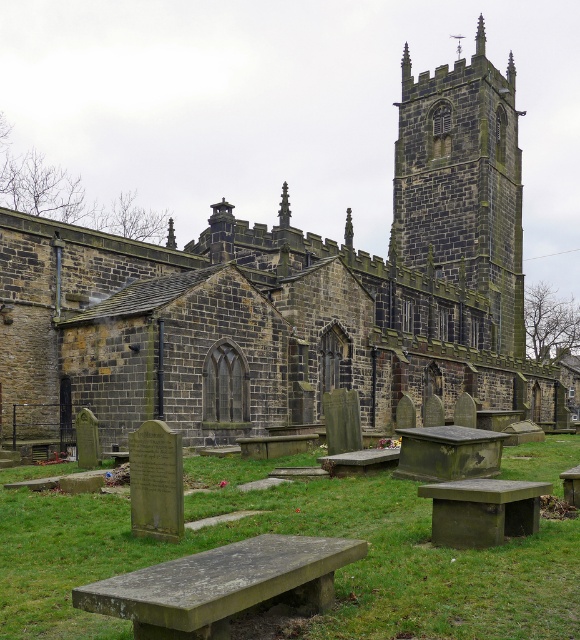
Question: Is gray stone bench at lower center to the left of concrete bench at lower center from the viewer's perspective?

Choices:
 (A) yes
 (B) no

Answer: (A)

Question: Is dark gray stone tower at center thinner than concrete bench at lower center?

Choices:
 (A) yes
 (B) no

Answer: (B)

Question: Which object is closer to the camera taking this photo?

Choices:
 (A) green moss-covered bench at center
 (B) gray stone bench at lower center
 (C) rustic wooden bench at center
 (D) dark gray stone tower at center

Answer: (B)

Question: Can you confirm if gray stone bench at lower center is positioned to the left of wooden bench at lower right?

Choices:
 (A) no
 (B) yes

Answer: (B)

Question: Which of the following is the farthest from the observer?

Choices:
 (A) green mossy stone bench at center
 (B) concrete bench at lower center
 (C) gray stone bench at lower center

Answer: (A)

Question: Among these points, which one is farthest from the camera?

Choices:
 (A) (385, 465)
 (B) (568, 484)

Answer: (A)